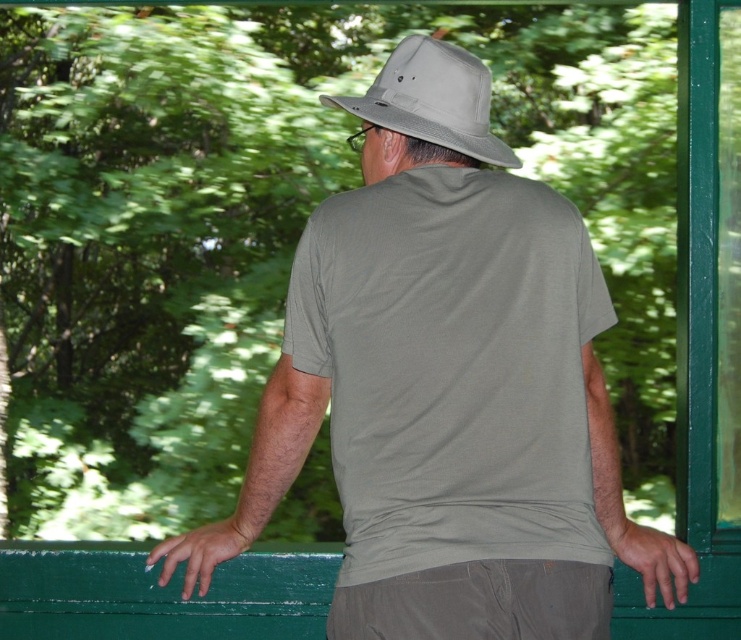
Question: Among these objects, which one is nearest to the camera?

Choices:
 (A) matte khaki hat at center
 (B) gray fabric fedora at upper center

Answer: (A)

Question: Which object appears farthest from the camera in this image?

Choices:
 (A) matte khaki hat at center
 (B) gray fabric fedora at upper center

Answer: (B)

Question: Does matte khaki hat at center come in front of gray fabric fedora at upper center?

Choices:
 (A) yes
 (B) no

Answer: (A)

Question: Which object is farther from the camera taking this photo?

Choices:
 (A) matte khaki hat at center
 (B) gray fabric fedora at upper center

Answer: (B)

Question: Is matte khaki hat at center to the right of gray fabric fedora at upper center from the viewer's perspective?

Choices:
 (A) no
 (B) yes

Answer: (A)

Question: Does matte khaki hat at center appear under gray fabric fedora at upper center?

Choices:
 (A) yes
 (B) no

Answer: (A)